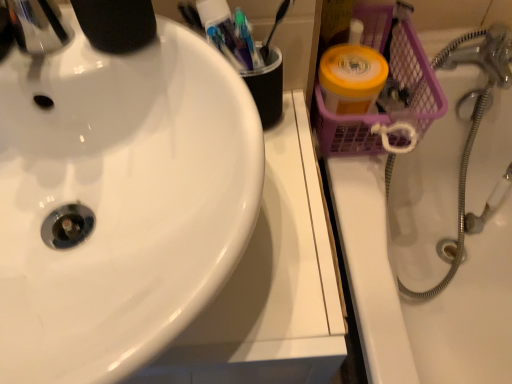
Image resolution: width=512 pixels, height=384 pixels. Describe the element at coordinates (120, 201) in the screenshot. I see `white glossy sink at left` at that location.

At what (x,y) coordinates should I click in order to perform the action: click on white glossy sink at left. Please return your answer as a coordinate pair (x, y). This screenshot has height=384, width=512. Looking at the image, I should click on (120, 201).

What do you see at coordinates (423, 266) in the screenshot? This screenshot has width=512, height=384. I see `purple mesh basket at upper right` at bounding box center [423, 266].

In order to face purple mesh basket at upper right, should I rotate leftwards or rightwards?

Turn right by 26.481 degrees to look at purple mesh basket at upper right.

At what (x,y) coordinates should I click in order to perform the action: click on purple mesh basket at upper right. Please return your answer as a coordinate pair (x, y). This screenshot has height=384, width=512. Looking at the image, I should click on (423, 266).

Locate an element on the screen. This screenshot has width=512, height=384. white glossy sink at left is located at coordinates (120, 201).

Between purple mesh basket at upper right and white glossy sink at left, which one appears on the right side from the viewer's perspective?

Positioned to the right is purple mesh basket at upper right.

Which object is more forward, purple mesh basket at upper right or white glossy sink at left?

white glossy sink at left is in front.

Which is less distant, (490, 369) or (62, 162)?

The point (62, 162) is closer.

From the image's perspective, which is above, purple mesh basket at upper right or white glossy sink at left?

white glossy sink at left is shown above in the image.

From a real-world perspective, between purple mesh basket at upper right and white glossy sink at left, who is vertically higher?

white glossy sink at left is physically above.

Considering the sizes of objects purple mesh basket at upper right and white glossy sink at left in the image provided, who is wider, purple mesh basket at upper right or white glossy sink at left?

Wider between the two is white glossy sink at left.

Can you confirm if purple mesh basket at upper right is taller than white glossy sink at left?

Correct, purple mesh basket at upper right is much taller as white glossy sink at left.

Considering the relative sizes of purple mesh basket at upper right and white glossy sink at left in the image provided, is purple mesh basket at upper right bigger than white glossy sink at left?

Yes, purple mesh basket at upper right is bigger than white glossy sink at left.

Would you say purple mesh basket at upper right is outside white glossy sink at left?

Yes, purple mesh basket at upper right is located beyond the bounds of white glossy sink at left.

Can you see purple mesh basket at upper right touching white glossy sink at left?

No, purple mesh basket at upper right is not next to white glossy sink at left.

Is purple mesh basket at upper right aimed at white glossy sink at left?

No, purple mesh basket at upper right is not oriented towards white glossy sink at left.

Locate an element on the screen. The height and width of the screenshot is (384, 512). sink above the purple mesh basket at upper right (from a real-world perspective) is located at coordinates (120, 201).

Between white glossy sink at left and purple mesh basket at upper right, which one appears on the right side from the viewer's perspective?

Positioned to the right is purple mesh basket at upper right.

Which object is further away from the camera, white glossy sink at left or purple mesh basket at upper right?

purple mesh basket at upper right is behind.

Is point (41, 177) farther from camera compared to point (494, 283)?

No, (41, 177) is closer to viewer.

From the image's perspective, is white glossy sink at left on top of purple mesh basket at upper right?

Yes.

Based on the photo, from a real-world perspective, is white glossy sink at left on purple mesh basket at upper right?

Correct, in the physical world, white glossy sink at left is higher than purple mesh basket at upper right.

Between white glossy sink at left and purple mesh basket at upper right, which one has smaller width?

purple mesh basket at upper right is thinner.

Between white glossy sink at left and purple mesh basket at upper right, which one has less height?

With less height is white glossy sink at left.

Is white glossy sink at left bigger than purple mesh basket at upper right?

No, white glossy sink at left is not bigger than purple mesh basket at upper right.

Is white glossy sink at left located outside purple mesh basket at upper right?

Indeed, white glossy sink at left is completely outside purple mesh basket at upper right.

Is white glossy sink at left next to purple mesh basket at upper right and touching it?

white glossy sink at left and purple mesh basket at upper right are clearly separated.

Does white glossy sink at left turn towards purple mesh basket at upper right?

No.

How many degrees apart are the facing directions of white glossy sink at left and purple mesh basket at upper right?

0.181 degrees separate the facing orientations of white glossy sink at left and purple mesh basket at upper right.

Measure the distance between white glossy sink at left and purple mesh basket at upper right.

They are 28.39 inches apart.

The height and width of the screenshot is (384, 512). I want to click on sink lying in front of the purple mesh basket at upper right, so click(120, 201).

At what (x,y) coordinates should I click in order to perform the action: click on sink lying above the purple mesh basket at upper right (from the image's perspective). Please return your answer as a coordinate pair (x, y). Looking at the image, I should click on (120, 201).

Locate an element on the screen. This screenshot has height=384, width=512. bath on the right of white glossy sink at left is located at coordinates (423, 266).